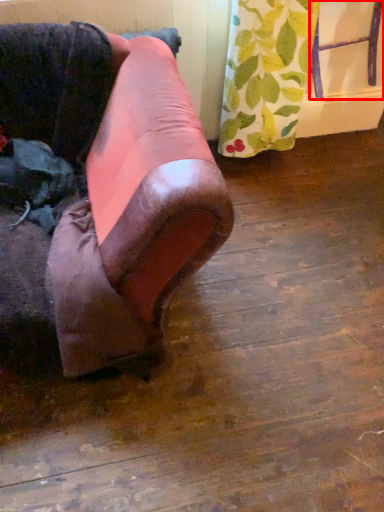
Question: From the image's perspective, where is furniture (annotated by the red box) located relative to furniture?

Choices:
 (A) above
 (B) below

Answer: (A)